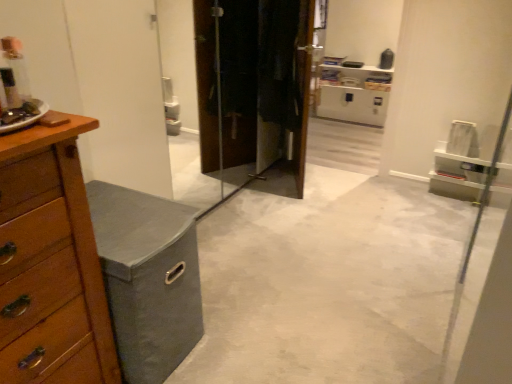
Question: From the image's perspective, would you say wooden chest of drawers at left is positioned over wooden vanity at left?

Choices:
 (A) yes
 (B) no

Answer: (A)

Question: Can you confirm if wooden chest of drawers at left is positioned to the left of wooden vanity at left?

Choices:
 (A) yes
 (B) no

Answer: (A)

Question: Is wooden vanity at left inside wooden chest of drawers at left?

Choices:
 (A) no
 (B) yes

Answer: (A)

Question: Does wooden chest of drawers at left come in front of wooden vanity at left?

Choices:
 (A) no
 (B) yes

Answer: (B)

Question: Considering the relative sizes of wooden chest of drawers at left and wooden vanity at left in the image provided, is wooden chest of drawers at left shorter than wooden vanity at left?

Choices:
 (A) no
 (B) yes

Answer: (A)

Question: Can we say wooden chest of drawers at left lies outside wooden vanity at left?

Choices:
 (A) no
 (B) yes

Answer: (B)

Question: Considering the relative sizes of gray fabric storage bin at left and wooden chest of drawers at left in the image provided, is gray fabric storage bin at left shorter than wooden chest of drawers at left?

Choices:
 (A) yes
 (B) no

Answer: (A)

Question: Is gray fabric storage bin at left positioned in front of wooden chest of drawers at left?

Choices:
 (A) yes
 (B) no

Answer: (B)

Question: Is gray fabric storage bin at left far away from wooden chest of drawers at left?

Choices:
 (A) no
 (B) yes

Answer: (B)

Question: Is gray fabric storage bin at left taller than wooden chest of drawers at left?

Choices:
 (A) yes
 (B) no

Answer: (B)

Question: From the image's perspective, would you say gray fabric storage bin at left is positioned over wooden chest of drawers at left?

Choices:
 (A) yes
 (B) no

Answer: (B)

Question: Is gray fabric storage bin at left thinner than wooden chest of drawers at left?

Choices:
 (A) yes
 (B) no

Answer: (B)

Question: Would you say gray fabric storage bin at left is part of wooden chest of drawers at left's contents?

Choices:
 (A) yes
 (B) no

Answer: (B)